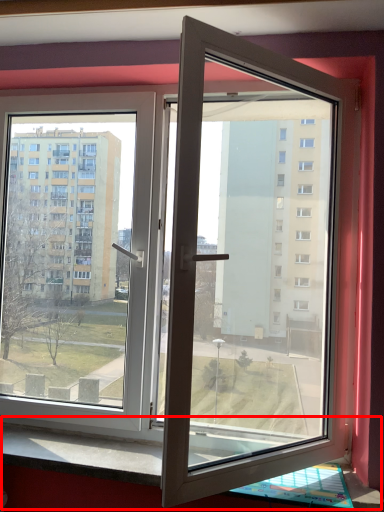
Question: Considering the relative positions of window sill (annotated by the red box) and door in the image provided, where is window sill (annotated by the red box) located with respect to the staircase?

Choices:
 (A) right
 (B) left

Answer: (A)